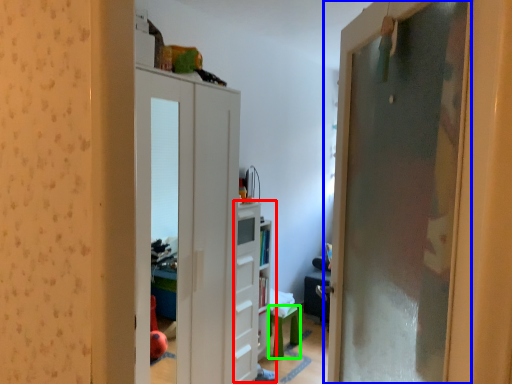
Question: Which is nearer to the dresser (highlighted by a red box)? door (highlighted by a blue box) or furniture (highlighted by a green box).

Choices:
 (A) door
 (B) furniture

Answer: (B)